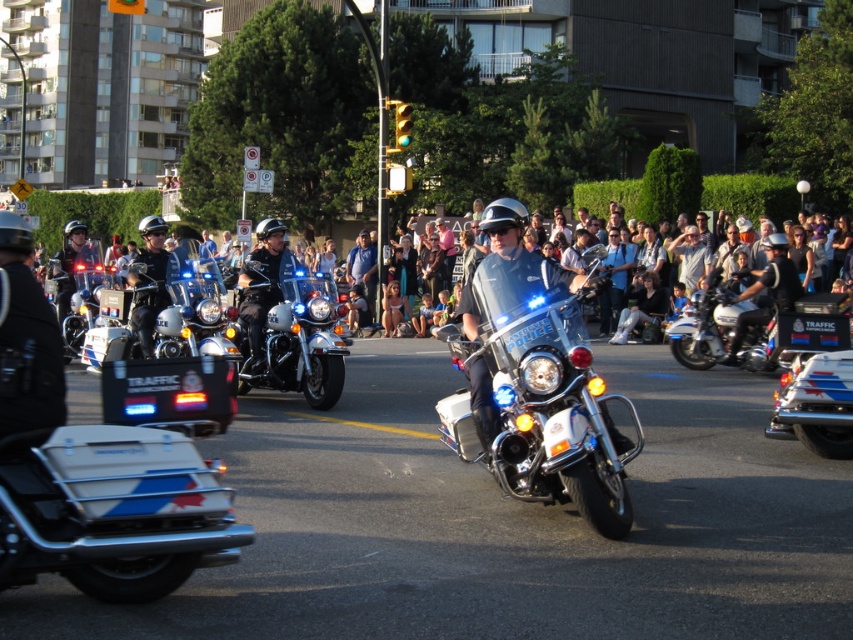
You are a photographer positioned at the front of the crowd watching the police motorcycle procession. You want to capture a clear photo of the glossy white motorcycle at center and the metallic blue motorcycle at center. Which motorcycle should you focus on first to ensure it appears in front in the photo?

The glossy white motorcycle at center is in front of the metallic blue motorcycle at center, so you should focus on the glossy white motorcycle at center first to ensure it appears in front in the photo.

You are a photographer positioned on the sidewalk. You want to capture both the metallic blue motorcycle at center and the white glossy motorcycle at center in a single shot. Which motorcycle should you focus on first to ensure both are in frame?

The metallic blue motorcycle at center is located below the white glossy motorcycle at center, so you should focus on the white glossy motorcycle at center first to ensure both are in frame.

You are a pedestrian standing on the sidewalk and see the metallic blue motorcycle at center and the metallic silver helmet at center. Which object is wider?

The metallic blue motorcycle at center is wider than the metallic silver helmet at center.